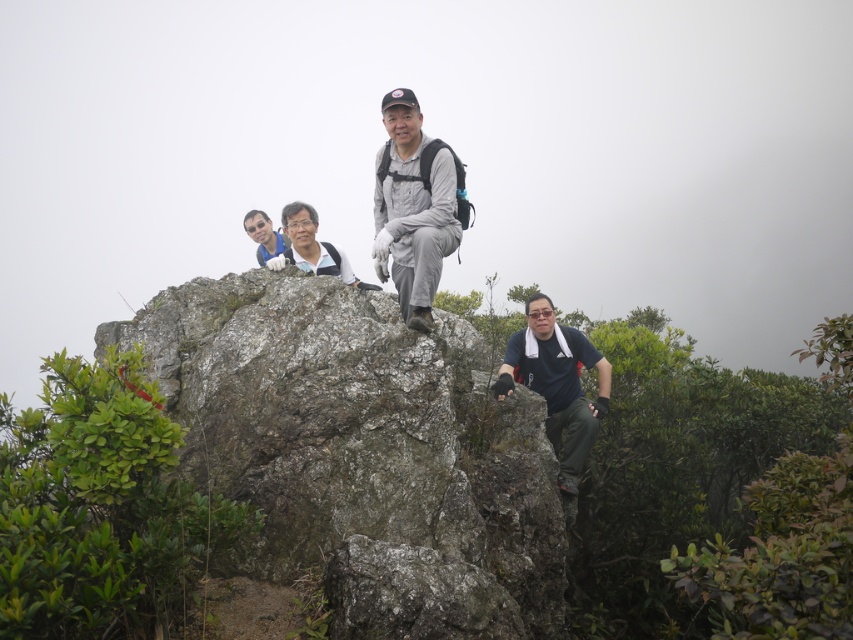
Which is behind, point (279, 538) or point (415, 212)?

Point (415, 212)

Which is in front, point (469, 602) or point (419, 196)?

Positioned in front is point (469, 602).

Identify the location of gray rough rock at center. (363, 452).

The height and width of the screenshot is (640, 853). Find the location of `gray fabric jacket at center`. gray fabric jacket at center is located at coordinates (412, 209).

Between point (426, 253) and point (531, 316), which one is positioned behind?

The point (531, 316) is more distant.

At what (x,y) coordinates should I click in order to perform the action: click on gray fabric jacket at center. Please return your answer as a coordinate pair (x, y). This screenshot has width=853, height=640. Looking at the image, I should click on (412, 209).

At what (x,y) coordinates should I click in order to perform the action: click on gray fabric jacket at center. Please return your answer as a coordinate pair (x, y). Image resolution: width=853 pixels, height=640 pixels. Looking at the image, I should click on (412, 209).

Can you confirm if gray rough rock at center is taller than dark blue t-shirt at center?

Correct, gray rough rock at center is much taller as dark blue t-shirt at center.

Does point (285, 360) come closer to viewer compared to point (564, 420)?

Yes, point (285, 360) is in front of point (564, 420).

Where is `gray rough rock at center`? gray rough rock at center is located at coordinates (363, 452).